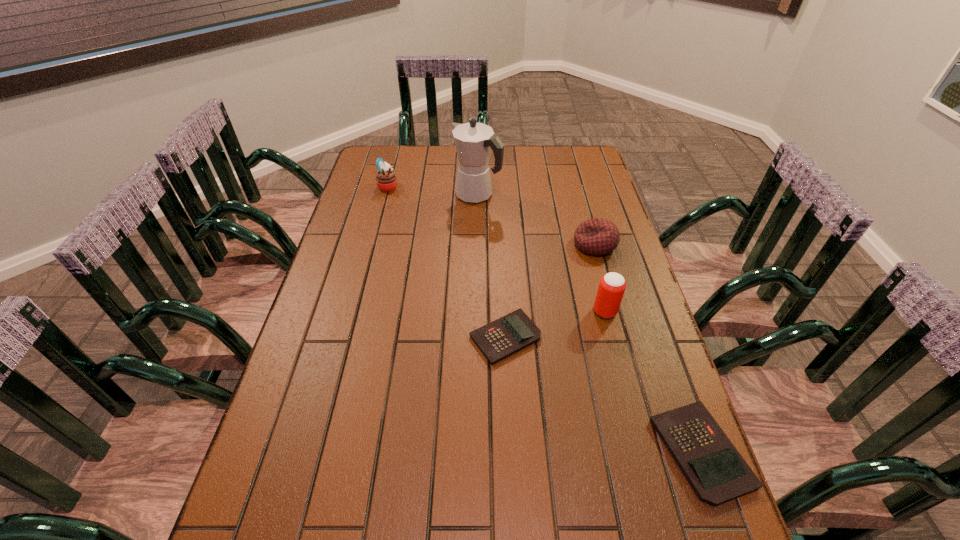
Locate an element on the screen. vacant space in between the fourth nearest object and the beer can is located at coordinates (600, 278).

The width and height of the screenshot is (960, 540). Find the location of `free point between the leftmost object and the tallest object`. free point between the leftmost object and the tallest object is located at coordinates (433, 191).

I want to click on free space between the taller calculator and the left calculator, so click(603, 395).

Where is `vacant space that is in between the shorter calculator and the muffin`? The image size is (960, 540). vacant space that is in between the shorter calculator and the muffin is located at coordinates (446, 262).

You are a GUI agent. You are given a task and a screenshot of the screen. Output one action in this format:
    pyautogui.click(x=<x>, y=<y>)
    Task: Click on the free point between the coffeepot and the shortest object
    Image resolution: width=960 pixels, height=540 pixels.
    Given the screenshot: What is the action you would take?
    pyautogui.click(x=492, y=267)

You are a GUI agent. You are given a task and a screenshot of the screen. Output one action in this format:
    pyautogui.click(x=<x>, y=<y>)
    Task: Click on the vacant region between the beanbag and the muffin
    This screenshot has height=540, width=960.
    Given the screenshot: What is the action you would take?
    pyautogui.click(x=492, y=215)

The width and height of the screenshot is (960, 540). In order to click on free area in between the nearest object and the beer can in this screenshot , I will do `click(653, 382)`.

At what (x,y) coordinates should I click in order to perform the action: click on object that can be found as the fifth closest to the beer can. Please return your answer as a coordinate pair (x, y). This screenshot has width=960, height=540. Looking at the image, I should click on (386, 180).

This screenshot has width=960, height=540. In order to click on object that stands as the closest to the farther calculator in this screenshot , I will do `click(612, 285)`.

Where is `vacant area that satisfies the following two spatial constraints: 1. on the back side of the beer can; 2. on the front-facing side of the leftmost object`? Image resolution: width=960 pixels, height=540 pixels. vacant area that satisfies the following two spatial constraints: 1. on the back side of the beer can; 2. on the front-facing side of the leftmost object is located at coordinates (572, 186).